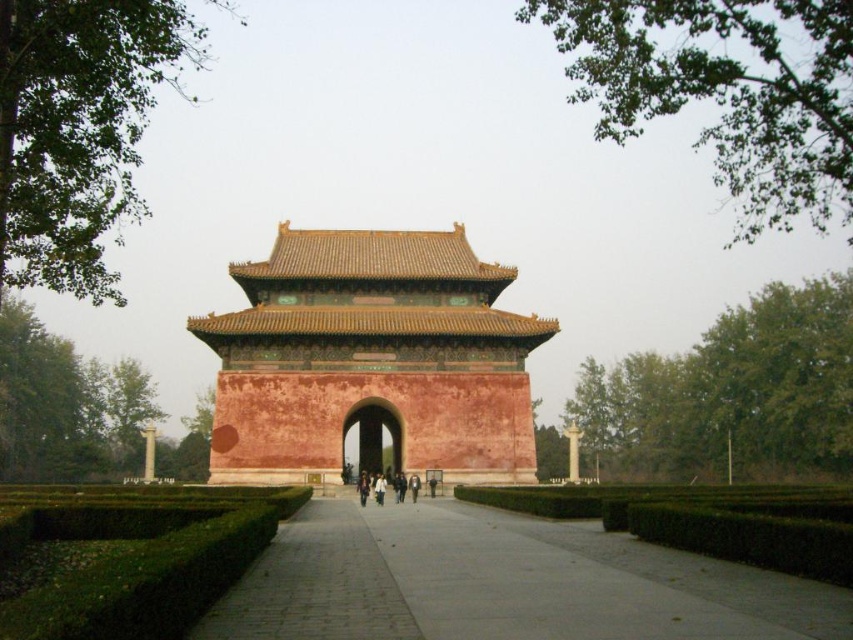
Looking at this image, you are standing at the entrance of the Ming Tombs complex and see the gatehouse at the end of a wide, paved pathway flanked by hedges. If you walk straight towards the gatehouse, which object will you first encounter at the point marked by coordinates point (502, 582)?

The point marked by coordinates point (502, 582) corresponds to the green hedge at center, so you will first encounter the green hedge at center when walking straight towards the gatehouse.

You are visiting the Ming Tombs and standing at the entrance of the gatehouse. You see a green hedge at center and a white matte jacket at center. Which object is positioned to the right when facing the gatehouse?

The green hedge at center is to the right of the white matte jacket at center when facing the gatehouse.